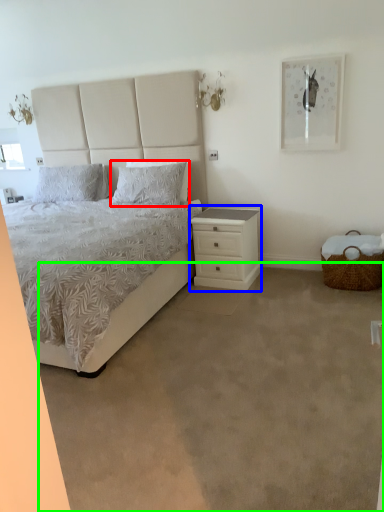
Question: Based on their relative distances, which object is nearer to pillow (highlighted by a red box)? Choose from nightstand (highlighted by a blue box) and plain (highlighted by a green box).

Choices:
 (A) nightstand
 (B) plain

Answer: (A)